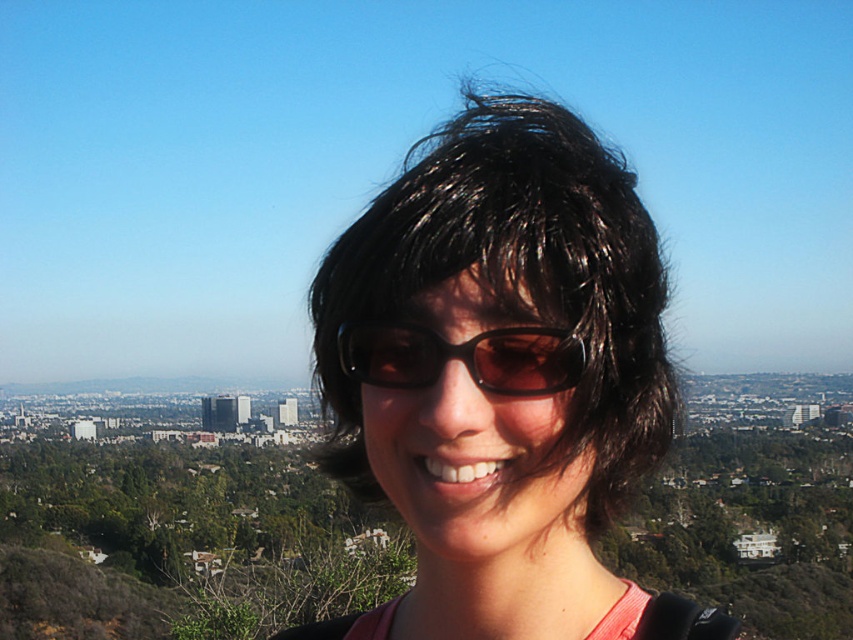
Question: Is shiny black hair at center to the right of black matte sunglasses at center from the viewer's perspective?

Choices:
 (A) no
 (B) yes

Answer: (B)

Question: Which point is farther to the camera?

Choices:
 (A) (541, 332)
 (B) (515, 387)

Answer: (B)

Question: Can you confirm if shiny black hair at center is wider than black matte sunglasses at center?

Choices:
 (A) no
 (B) yes

Answer: (B)

Question: Can you confirm if shiny black hair at center is positioned to the left of black matte sunglasses at center?

Choices:
 (A) no
 (B) yes

Answer: (A)